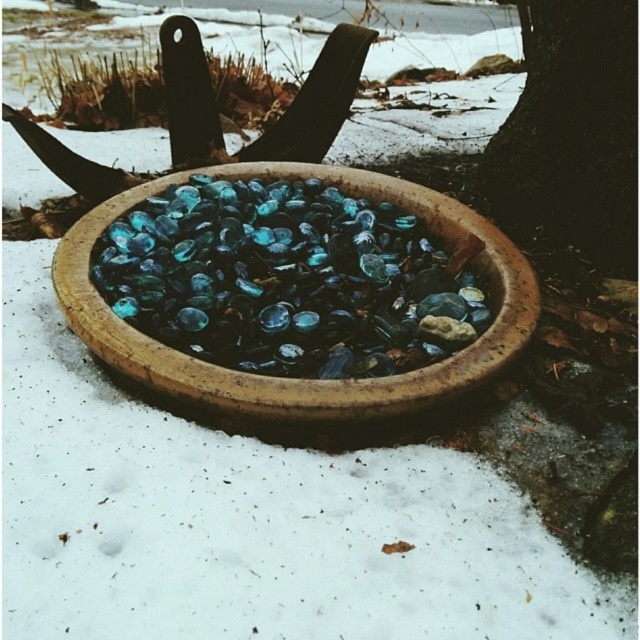
You are an interior designer planning to place a small potted plant between the translucent glass bowl at center and the dark brown textured tree trunk at upper right. Based on their heights, which object should the plant be placed closer to?

The translucent glass bowl at center has a lesser height compared to the dark brown textured tree trunk at upper right. Therefore, the plant should be placed closer to the translucent glass bowl at center to ensure visual balance between the objects.

Looking at this image, you are standing in the winter scene and want to place a small ornament on the closest object to you. Which object should you choose between the translucent glass bowl at center and the dark brown textured tree trunk at upper right?

The translucent glass bowl at center is closer to the viewer, so you should place the ornament on the translucent glass bowl at center.

You are standing in the winter scene and want to place a small ornament in the translucent glass bowl at center. To ensure it doesn not fall out, where should you position it relative to the dark brown textured tree trunk at upper right?

You should position the ornament to the left of the dark brown textured tree trunk at upper right because the translucent glass bowl at center is located to the left of it, so placing the ornament there would keep it within the bowl.